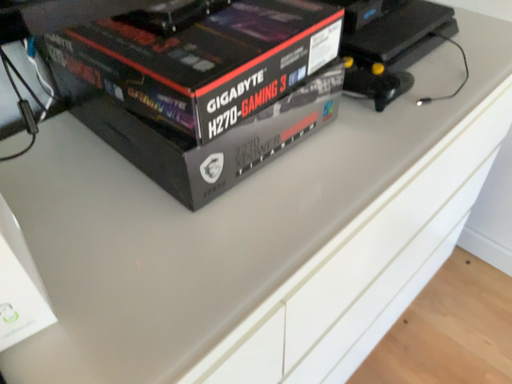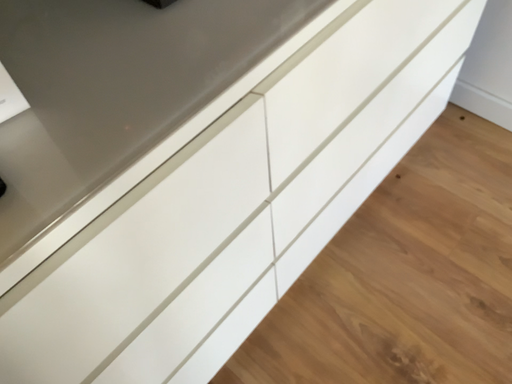
Question: How did the camera likely rotate when shooting the video?

Choices:
 (A) rotated upward
 (B) rotated downward

Answer: (B)